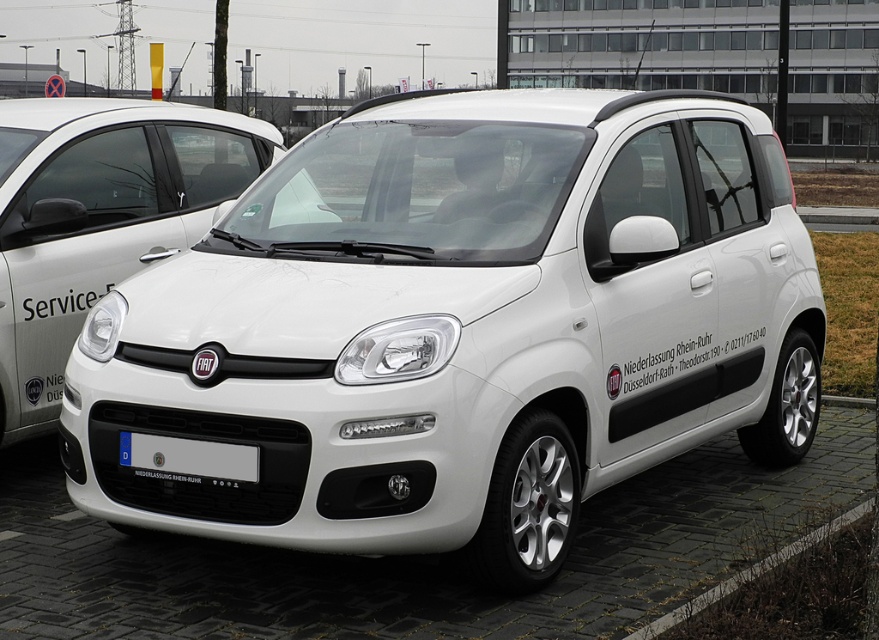
You are a delivery driver who needs to park your truck next to the white matte car at center and the white matte fiat car at center. The truck requires 10 feet of space. Is there enough space between them to park?

The white matte car at center and white matte fiat car at center are 7.73 feet apart, which is less than the required 10 feet for the truck. Therefore, there is not enough space to park between them.

Based on the photo, you are standing in front of the white Fiat Panda and want to touch both points on the car. Which point should you reach for first, the point at coordinate (4, 248) or the point at (166, 458)?

You should reach for the point at coordinate (4, 248) first because it is closer to you than the point at (166, 458).

You are a delivery person who needs to park your van next to the white matte car at center. The van requires a parking space that is at least as tall as the white plastic license plate at center. Can the van park here?

The white matte car at center is taller than the white plastic license plate at center. Since the van requires a space at least as tall as the license plate, and the car is taller than that, the van can park here as the space meets the height requirement.